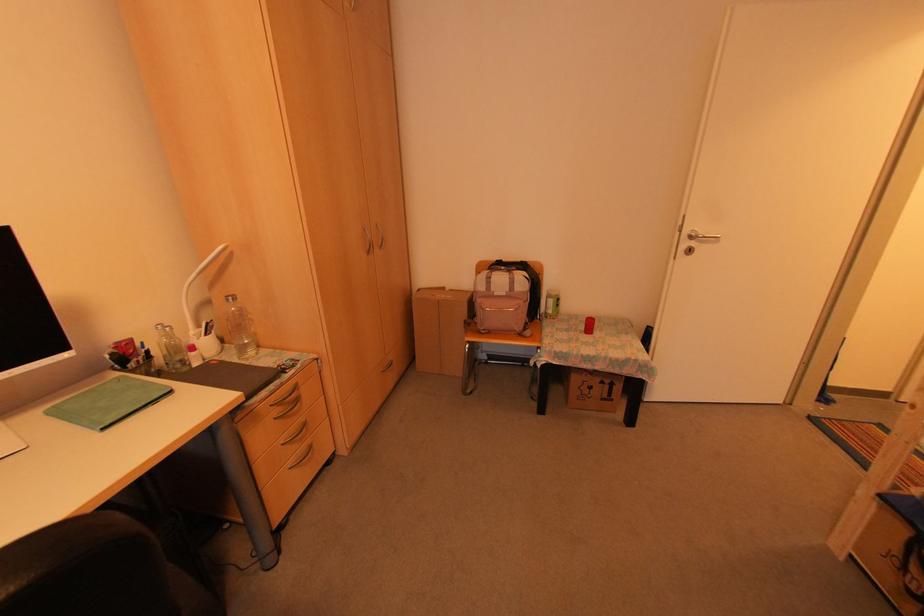
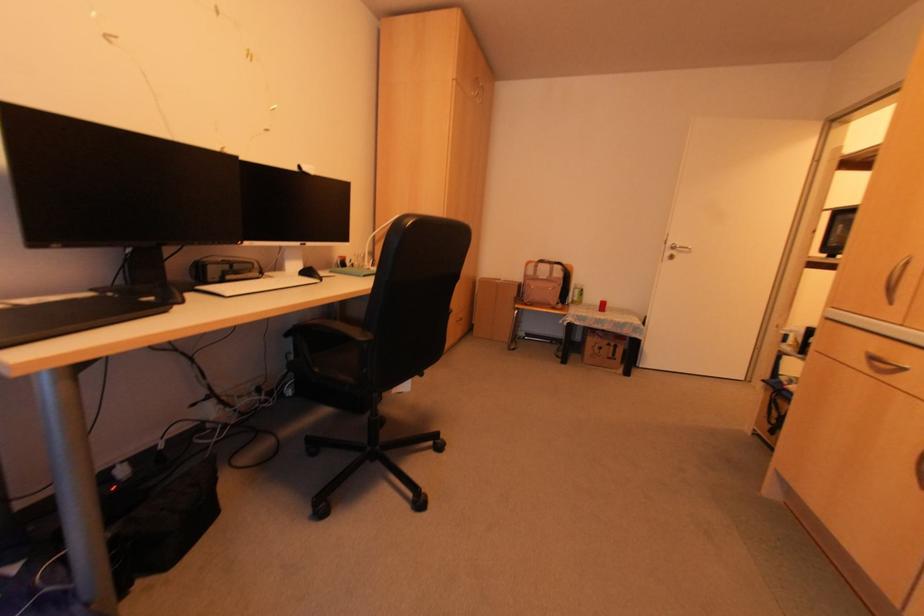
The point at (x=598, y=381) is marked in the first image. Where is the corresponding point in the second image?

(604, 342)